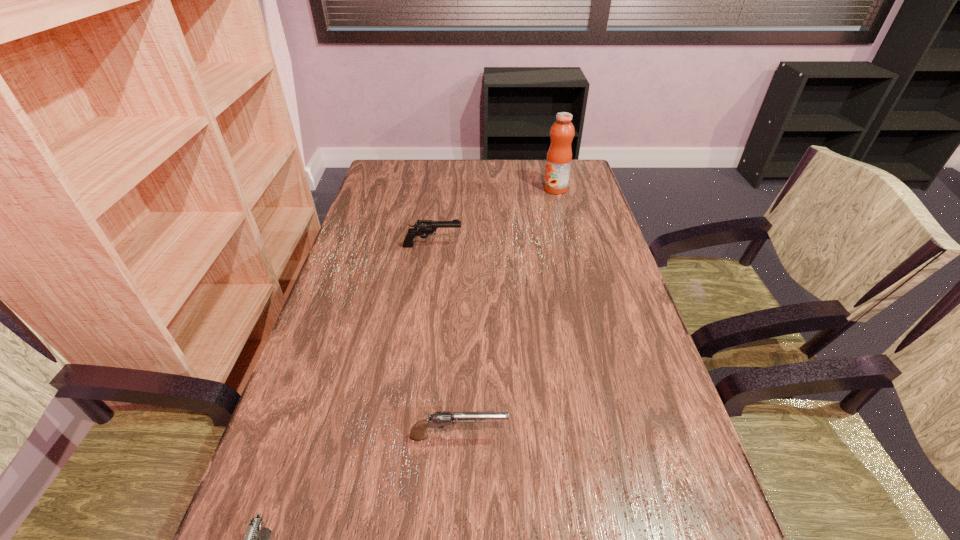
Where is `object at the far edge`? object at the far edge is located at coordinates (559, 156).

Identify the location of object positioned at the left edge. The width and height of the screenshot is (960, 540). (424, 227).

Locate an element on the screen. object situated at the right edge is located at coordinates (559, 156).

Where is `object that is at the far right corner`? This screenshot has height=540, width=960. object that is at the far right corner is located at coordinates (559, 156).

In the image, there is a desktop. Where is `vacant space at the far edge`? The height and width of the screenshot is (540, 960). vacant space at the far edge is located at coordinates (483, 181).

The height and width of the screenshot is (540, 960). Identify the location of free space at the left edge. 346,314.

I want to click on free space at the right edge, so click(595, 369).

In the image, there is a desktop. Identify the location of blank space at the far left corner. (378, 176).

At what (x,y) coordinates should I click in order to perform the action: click on vacant space at the far right corner of the desktop. Please return your answer as a coordinate pair (x, y). The height and width of the screenshot is (540, 960). Looking at the image, I should click on (578, 186).

Where is `empty space between the farthest gun and the third farthest object`? empty space between the farthest gun and the third farthest object is located at coordinates (445, 341).